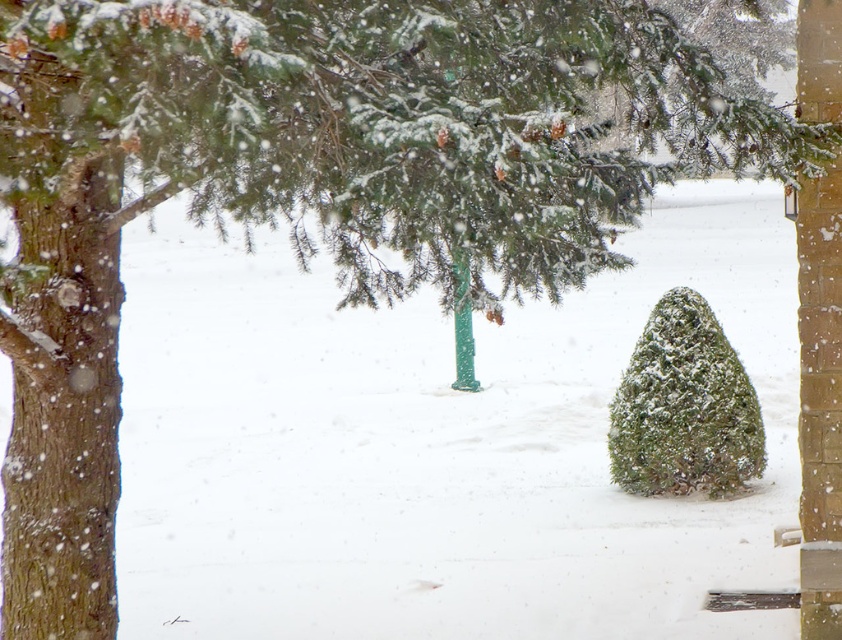
Question: Which point is farther from the camera taking this photo?

Choices:
 (A) (638, 438)
 (B) (465, 289)

Answer: (A)

Question: Which object is closer to the camera taking this photo?

Choices:
 (A) green plastic pole at center
 (B) green textured fir tree at center

Answer: (A)

Question: Is green textured fir tree at center to the right of green plastic pole at center from the viewer's perspective?

Choices:
 (A) yes
 (B) no

Answer: (A)

Question: Is green textured fir tree at center closer to camera compared to green plastic pole at center?

Choices:
 (A) no
 (B) yes

Answer: (A)

Question: Does green textured fir tree at center appear over green plastic pole at center?

Choices:
 (A) no
 (B) yes

Answer: (A)

Question: Which point appears farthest from the camera in this image?

Choices:
 (A) (663, 332)
 (B) (469, 333)

Answer: (B)